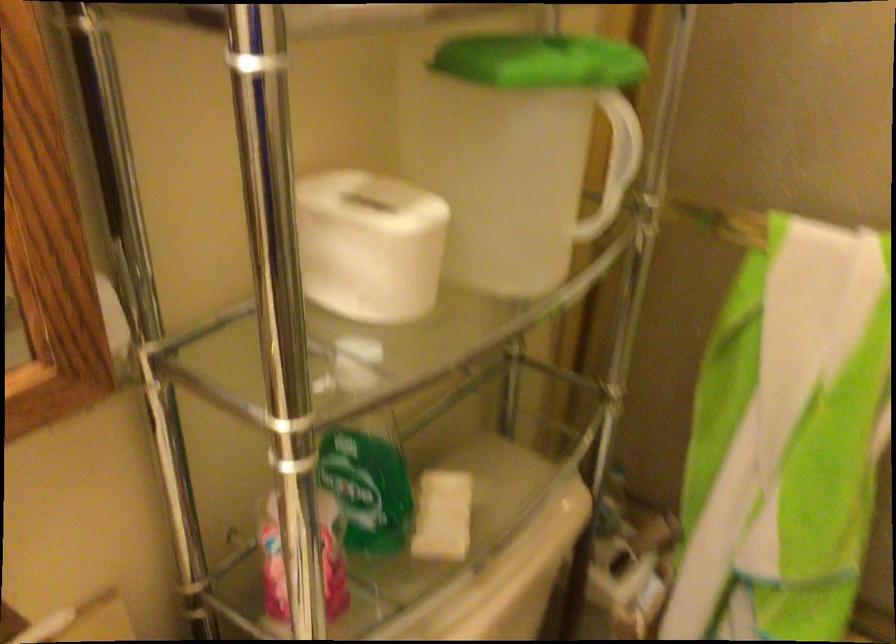
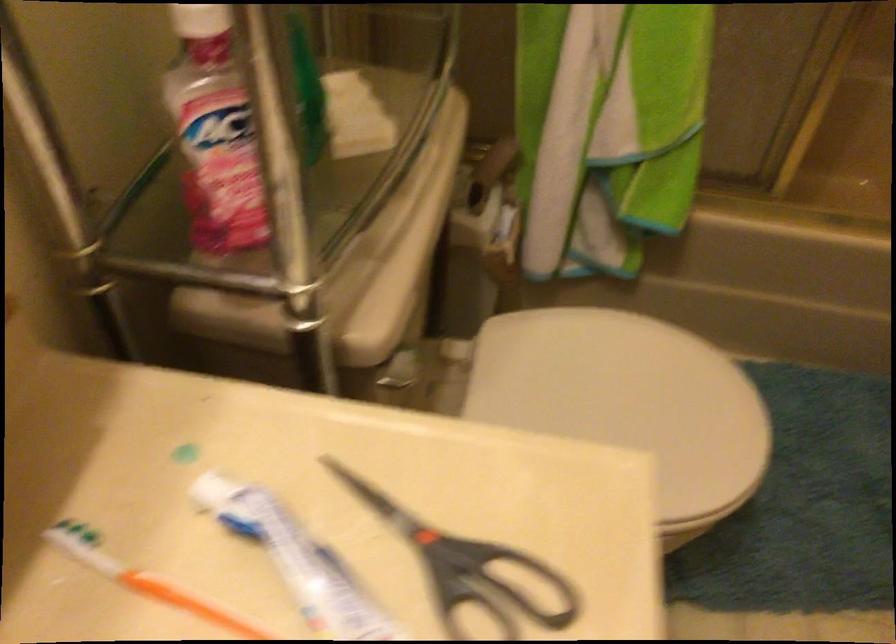
The first image is from the beginning of the video and the second image is from the end. How did the camera likely rotate when shooting the video?

The camera's rotation is toward right-down.